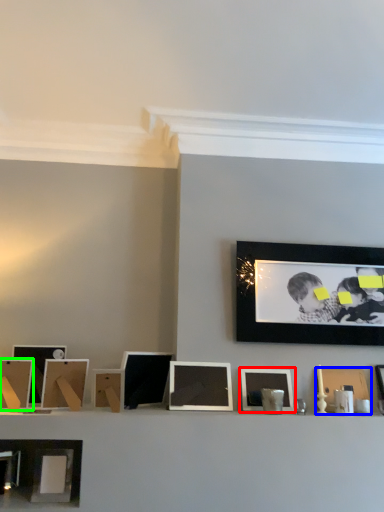
Question: Considering the real-world distances, which object is farthest from picture frame (highlighted by a red box)? picture frame (highlighted by a blue box) or picture frame (highlighted by a green box)?

Choices:
 (A) picture frame
 (B) picture frame

Answer: (B)